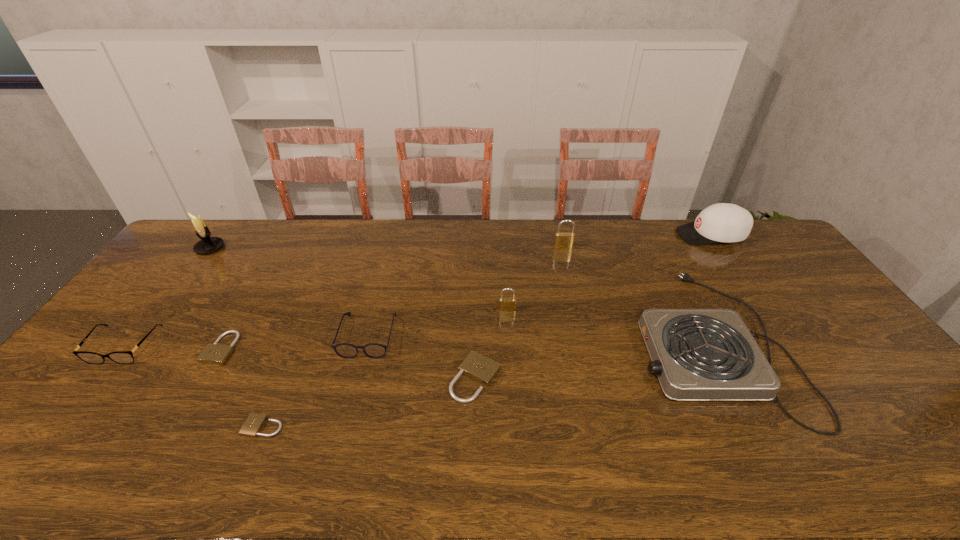
Locate an element on the screen. This screenshot has height=540, width=960. candle holder positioned at the far edge is located at coordinates (207, 244).

Find the location of `baseball cap present at the far edge`. baseball cap present at the far edge is located at coordinates (722, 222).

Locate an element on the screen. This screenshot has width=960, height=540. padlock that is at the far edge is located at coordinates (564, 240).

Image resolution: width=960 pixels, height=540 pixels. I want to click on candle holder at the left edge, so click(x=207, y=244).

Image resolution: width=960 pixels, height=540 pixels. Find the location of `spectacles that is at the left edge`. spectacles that is at the left edge is located at coordinates (121, 357).

In order to click on object located in the right edge section of the desktop in this screenshot , I will do `click(722, 222)`.

Where is `object present at the far left corner`? This screenshot has height=540, width=960. object present at the far left corner is located at coordinates (207, 244).

You are a GUI agent. You are given a task and a screenshot of the screen. Output one action in this format:
    pyautogui.click(x=<x>, y=<y>)
    Task: Click on the object present at the far right corner
    The image size is (960, 540).
    Given the screenshot: What is the action you would take?
    pyautogui.click(x=722, y=222)

At what (x,y) coordinates should I click in order to perform the action: click on free space at the far edge. Please return your answer as a coordinate pair (x, y). Looking at the image, I should click on (298, 231).

In the image, there is a desktop. Where is `vacant space at the near edge`? The image size is (960, 540). vacant space at the near edge is located at coordinates (841, 470).